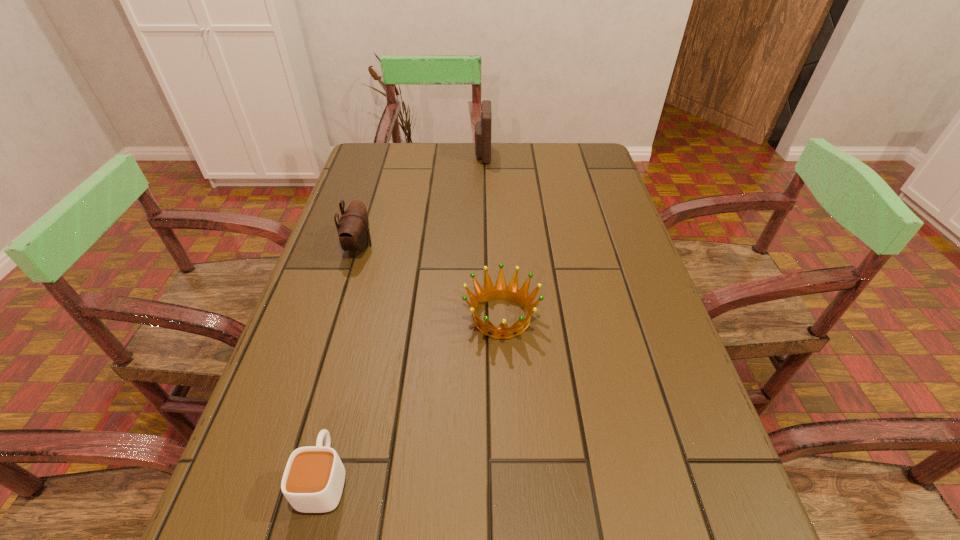
Locate an element on the screen. The height and width of the screenshot is (540, 960). free space located 0.290m on the front of the crown is located at coordinates (510, 501).

At what (x,y) coordinates should I click in order to perform the action: click on vacant area located on the side with the handle of the nearest object. Please return your answer as a coordinate pair (x, y). Looking at the image, I should click on (x=359, y=336).

Where is `free spot located 0.080m on the side with the handle of the nearest object`? free spot located 0.080m on the side with the handle of the nearest object is located at coordinates 344,401.

Locate an element on the screen. free region located 0.120m on the side with the handle of the nearest object is located at coordinates (348, 382).

You are a GUI agent. You are given a task and a screenshot of the screen. Output one action in this format:
    pyautogui.click(x=<x>, y=<y>)
    Task: Click on the object that is at the far edge
    The height and width of the screenshot is (540, 960).
    Given the screenshot: What is the action you would take?
    pyautogui.click(x=482, y=136)

Image resolution: width=960 pixels, height=540 pixels. Find the location of `pouch positioned at the left edge`. pouch positioned at the left edge is located at coordinates (353, 229).

I want to click on cup that is at the left edge, so click(x=313, y=480).

The image size is (960, 540). Find the location of `vacant space at the far edge of the desktop`. vacant space at the far edge of the desktop is located at coordinates (462, 144).

I want to click on vacant area at the left edge, so click(x=354, y=390).

Where is `free space at the right edge of the desktop`? The image size is (960, 540). free space at the right edge of the desktop is located at coordinates (669, 522).